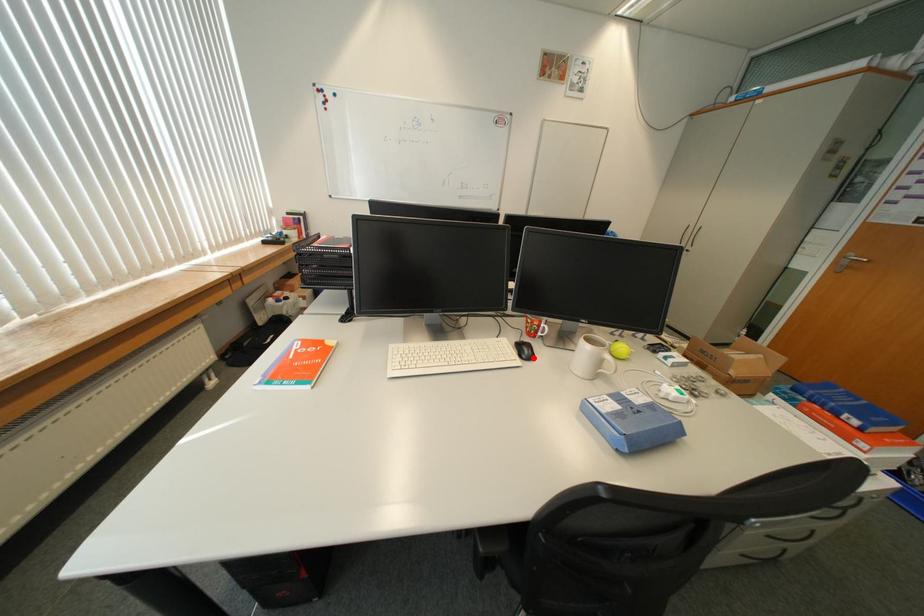
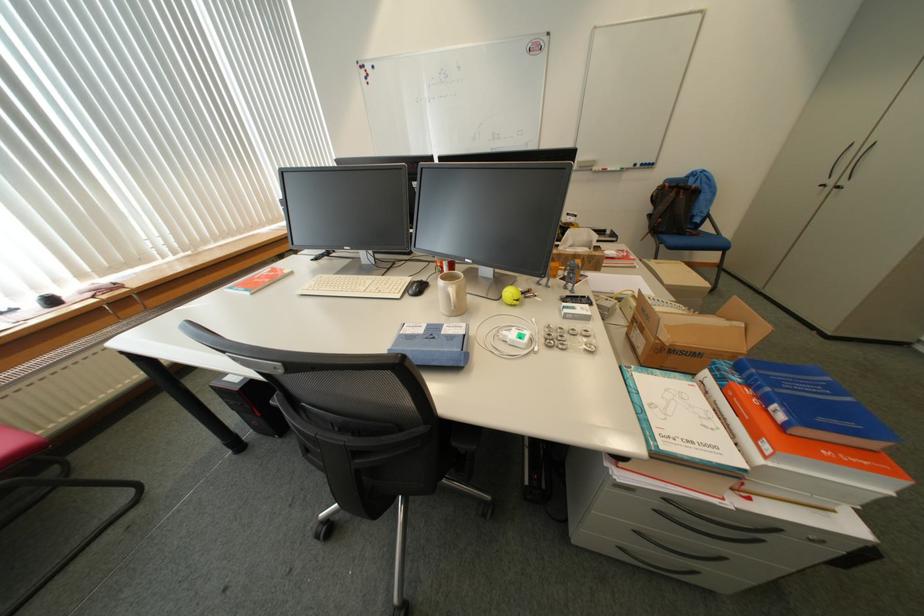
Find the pixel in the second image that matches the highlighted location in the first image.

(419, 293)